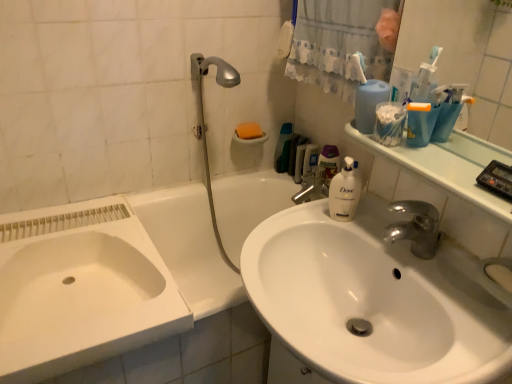
What are the coordinates of `vacant area that is in front of green plastic container at upper center, placed as the 3th mouthwash when sorted from front to back` in the screenshot? It's located at (285, 182).